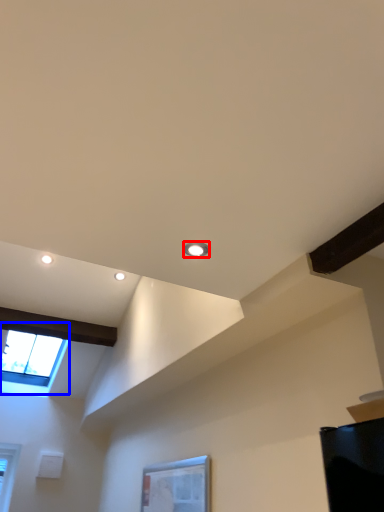
Question: Among these objects, which one is farthest to the camera, droplight (highlighted by a red box) or window (highlighted by a blue box)?

Choices:
 (A) droplight
 (B) window

Answer: (B)